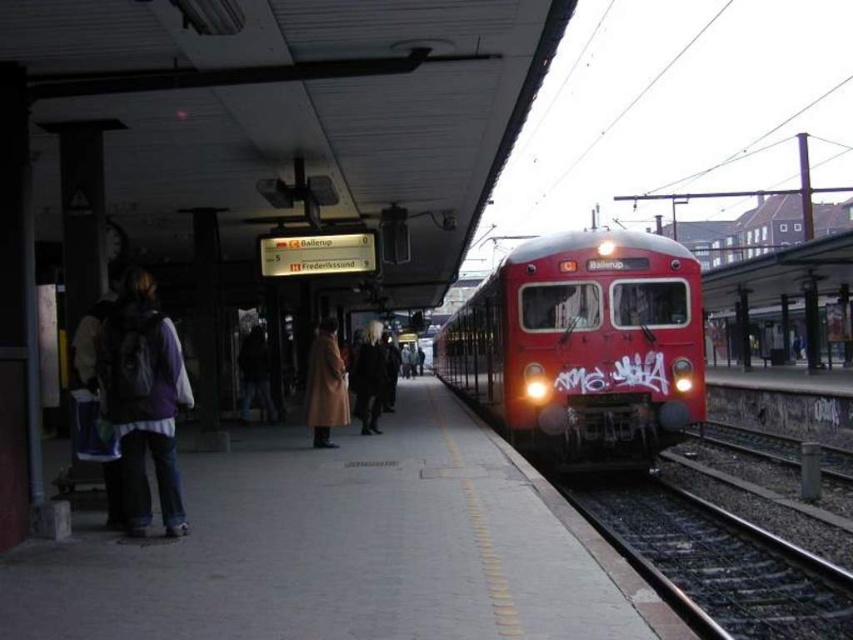
You are standing on the concrete platform at center and want to know if you can safely walk to the edge without stepping on the dark brown leather coat at center. Can you do that?

The concrete platform at center is wider than the dark brown leather coat at center, so you can walk to the edge safely without stepping on the coat.

You are standing on the train station platform and want to find the point at coordinates (346, 548). According to the scene description, where would this point be located?

The point at coordinates (346, 548) is on the concrete platform at center.

You are on the train station platform and want to move from point (305, 595) to point (480, 365). Which direction should you walk to get closer to your destination?

You should walk away from the tracks because point (480, 365) is further from the viewer than point (305, 595).